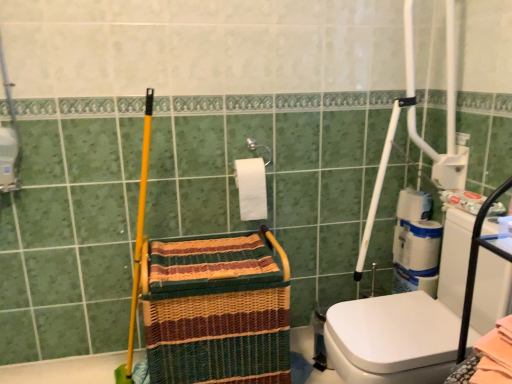
Question: Is woven straw basket at center taller or shorter than white glossy washer at right?

Choices:
 (A) short
 (B) tall

Answer: (A)

Question: From the image's perspective, is woven straw basket at center above or below white glossy washer at right?

Choices:
 (A) above
 (B) below

Answer: (B)

Question: Estimate the real-world distances between objects in this image. Which object is closer to the woven straw basket at center?

Choices:
 (A) white matte toilet paper at right, which ranks as the 1th toilet paper in back-to-front order
 (B) white glossy washer at right
 (C) white matte toilet paper at center, acting as the 1th toilet paper starting from the left

Answer: (C)

Question: Considering the real-world distances, which object is closest to the white matte toilet paper at center, the 1th toilet paper in the front-to-back sequence?

Choices:
 (A) white glossy washer at right
 (B) woven straw basket at center
 (C) white matte toilet paper at right, placed as the 2th toilet paper when sorted from left to right

Answer: (B)